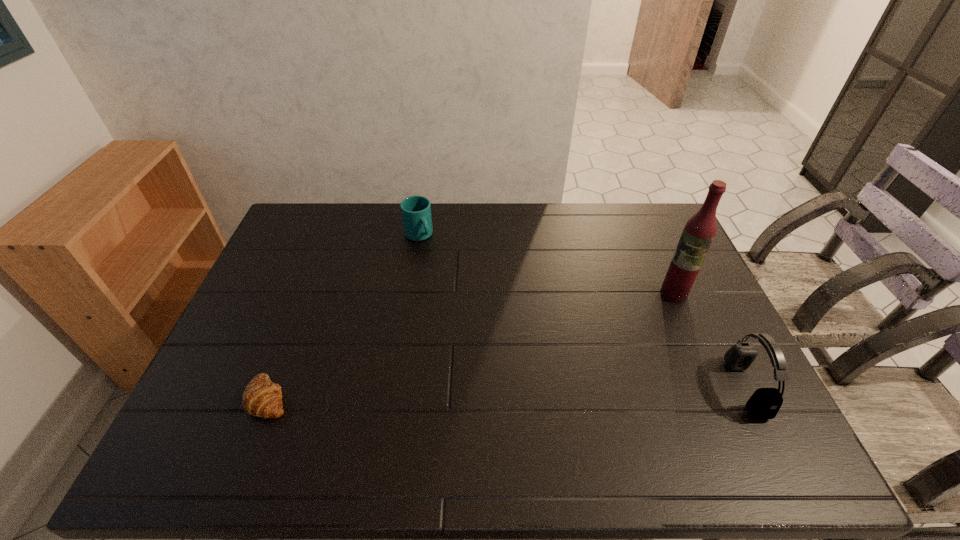
You are a GUI agent. You are given a task and a screenshot of the screen. Output one action in this format:
    pyautogui.click(x=<x>, y=<y>)
    Task: Click on the free space at the far left corner of the desktop
    
    Given the screenshot: What is the action you would take?
    pyautogui.click(x=324, y=221)

This screenshot has height=540, width=960. I want to click on unoccupied position between the second shortest object and the shortest object, so click(344, 316).

The image size is (960, 540). What are the coordinates of `free point between the shortest object and the third object from left to right` in the screenshot? It's located at (471, 346).

You are a GUI agent. You are given a task and a screenshot of the screen. Output one action in this format:
    pyautogui.click(x=<x>, y=<y>)
    Task: Click on the free space between the second farthest object and the leftmost object
    This screenshot has height=540, width=960.
    Given the screenshot: What is the action you would take?
    pyautogui.click(x=471, y=346)

The image size is (960, 540). I want to click on unoccupied position between the second object from right to left and the farthest object, so click(546, 265).

Identify the location of empty space that is in between the headset and the third object from right to left. The width and height of the screenshot is (960, 540). (582, 312).

You are a GUI agent. You are given a task and a screenshot of the screen. Output one action in this format:
    pyautogui.click(x=<x>, y=<y>)
    Task: Click on the empty location between the leftmost object and the rightmost object
    This screenshot has height=540, width=960.
    Given the screenshot: What is the action you would take?
    pyautogui.click(x=507, y=393)

Locate an element on the screen. vacant point located between the headset and the farthest object is located at coordinates (582, 312).

Image resolution: width=960 pixels, height=540 pixels. Identify the location of empty space between the third shortest object and the third object from right to left. (582, 312).

This screenshot has height=540, width=960. Find the location of `free point between the headset and the leftmost object`. free point between the headset and the leftmost object is located at coordinates (507, 393).